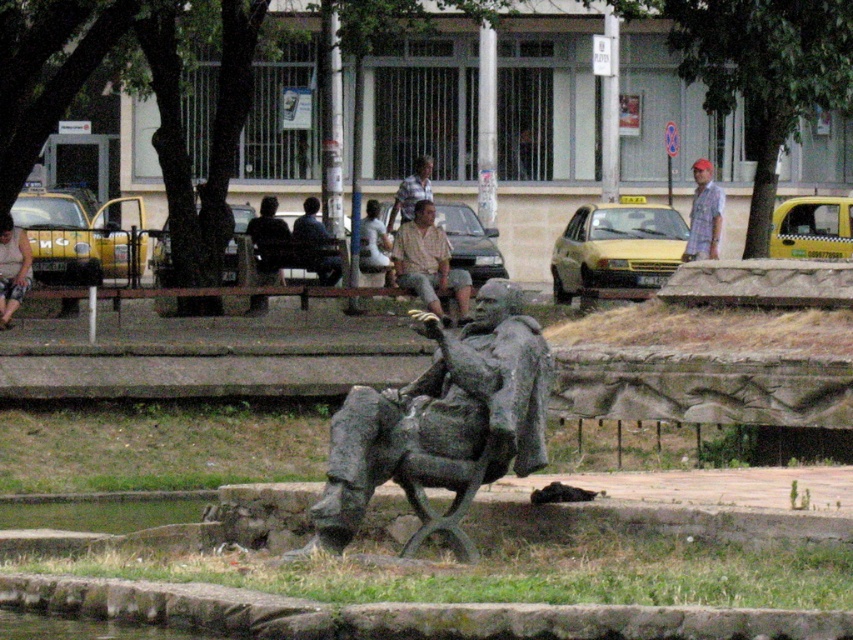
Question: Which object is the farthest from the plaid shirt at center?

Choices:
 (A) matte brown shirt at center
 (B) matte black shirt at left
 (C) bronze statue at center

Answer: (C)

Question: Among these objects, which one is farthest from the camera?

Choices:
 (A) dark blue shirt at center
 (B) matte brown shirt at center

Answer: (A)

Question: Does matte brown shirt at center appear on the right side of dark blue shirt at center?

Choices:
 (A) no
 (B) yes

Answer: (B)

Question: Which point is closer to the camera?

Choices:
 (A) bronze statue at center
 (B) dark blue shirt at center
 (C) matte gray statue at center
 (D) plaid shirt at center

Answer: (A)

Question: Is the position of matte brown shirt at center more distant than that of light brown fabric shirt at center?

Choices:
 (A) yes
 (B) no

Answer: (B)

Question: Does bronze statue at center have a greater width compared to matte gray statue at center?

Choices:
 (A) no
 (B) yes

Answer: (B)